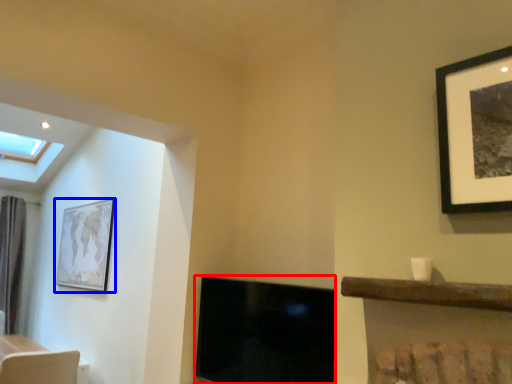
Question: Among these objects, which one is farthest to the camera, fireplace (highlighted by a red box) or picture frame (highlighted by a blue box)?

Choices:
 (A) fireplace
 (B) picture frame

Answer: (B)